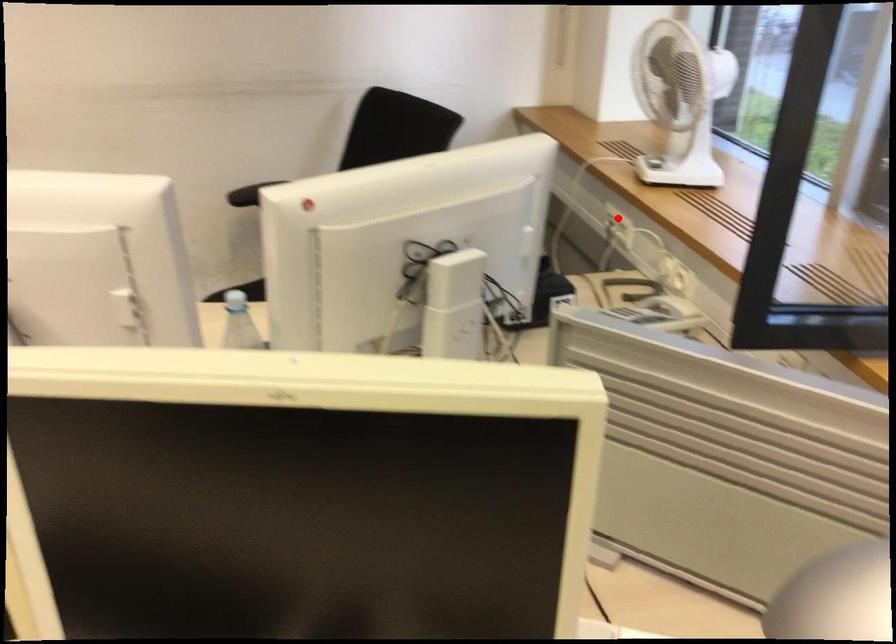
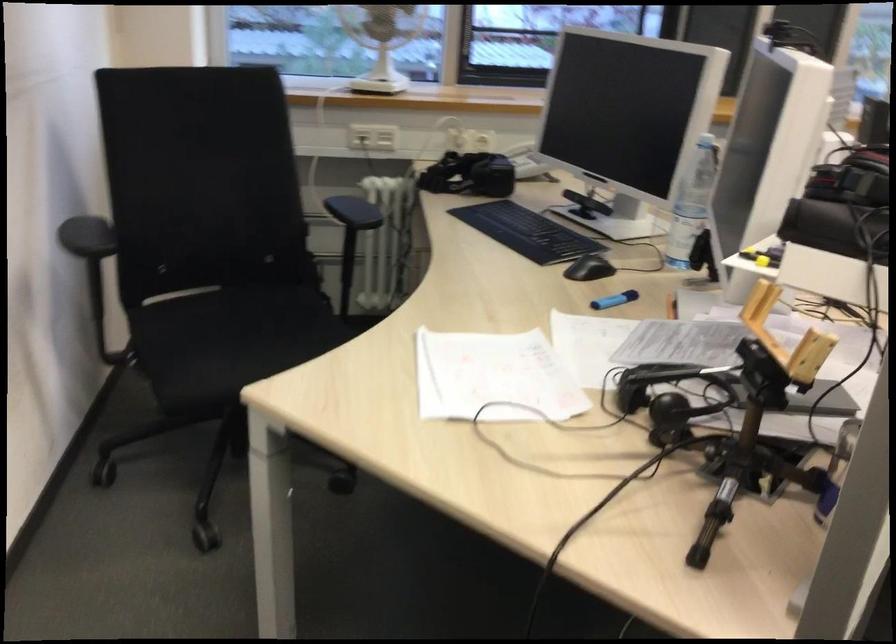
Locate, in the second image, the point that corresponds to the highlighted location in the first image.

(358, 138)